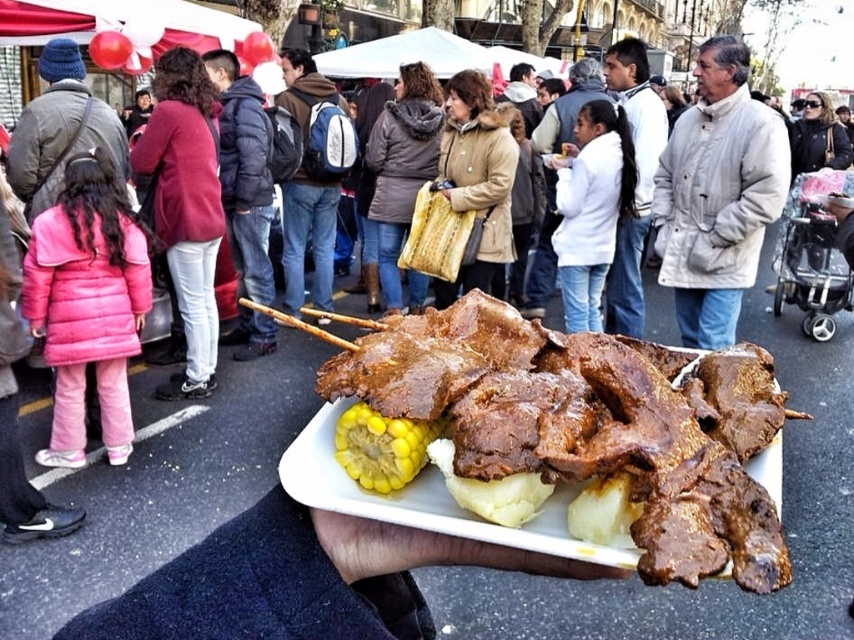
Consider the image. Who is shorter, brown glossy meat at center or light beige puffy coat at upper right?

brown glossy meat at center is shorter.

Can you confirm if brown glossy meat at center is smaller than light beige puffy coat at upper right?

Indeed, brown glossy meat at center has a smaller size compared to light beige puffy coat at upper right.

Is point (336, 356) positioned behind point (715, 44)?

No.

The height and width of the screenshot is (640, 854). Identify the location of brown glossy meat at center. (589, 422).